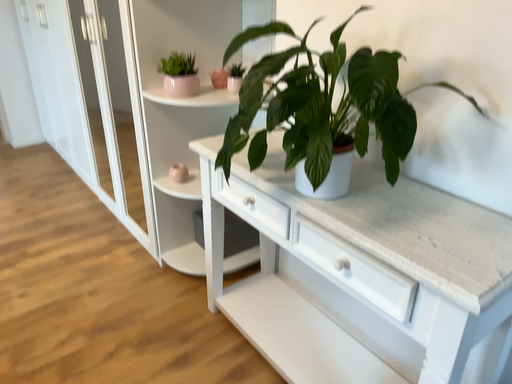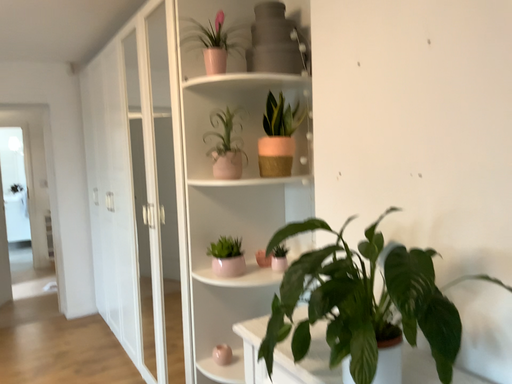
Question: How did the camera likely rotate when shooting the video?

Choices:
 (A) rotated downward
 (B) rotated upward

Answer: (B)